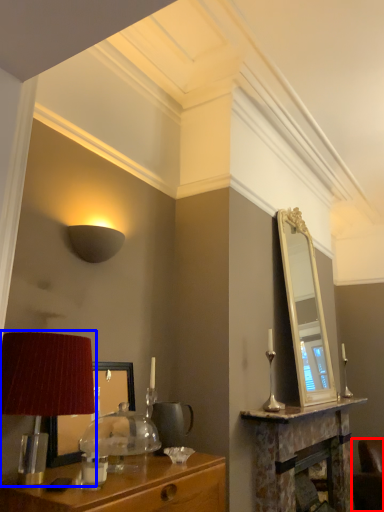
Question: Which object is further to the camera taking this photo, swivel chair (highlighted by a red box) or table lamp (highlighted by a blue box)?

Choices:
 (A) swivel chair
 (B) table lamp

Answer: (A)